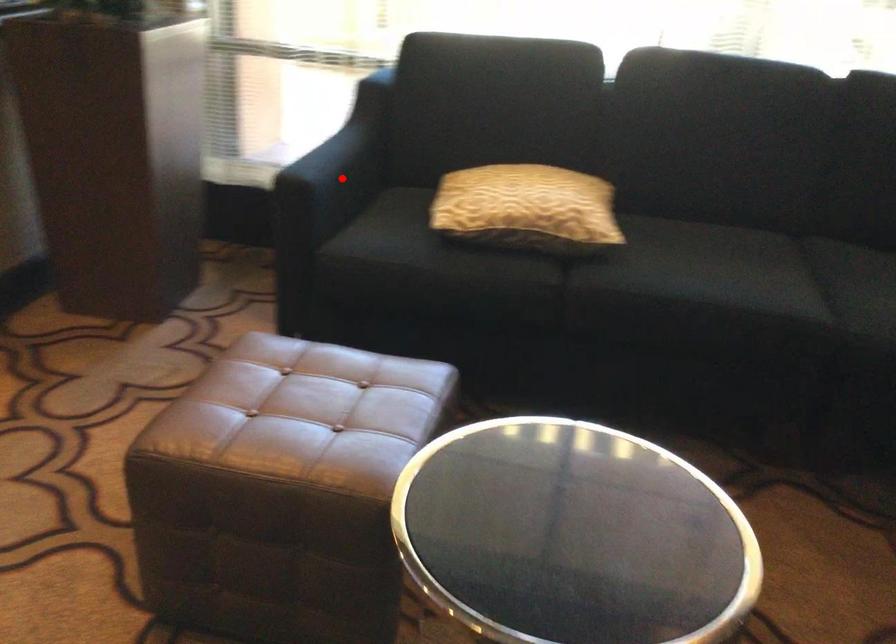
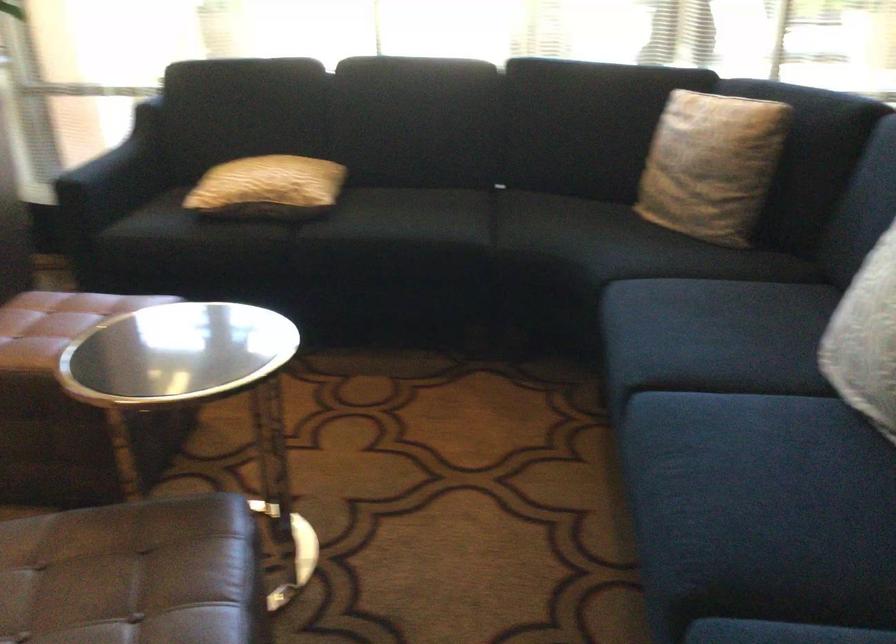
The point at the highlighted location is marked in the first image. Where is the corresponding point in the second image?

(115, 176)